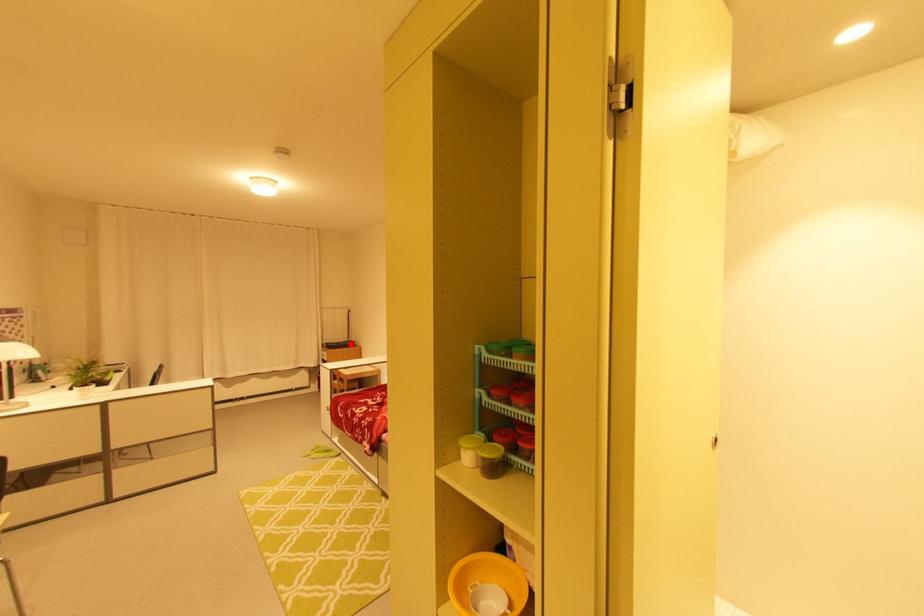
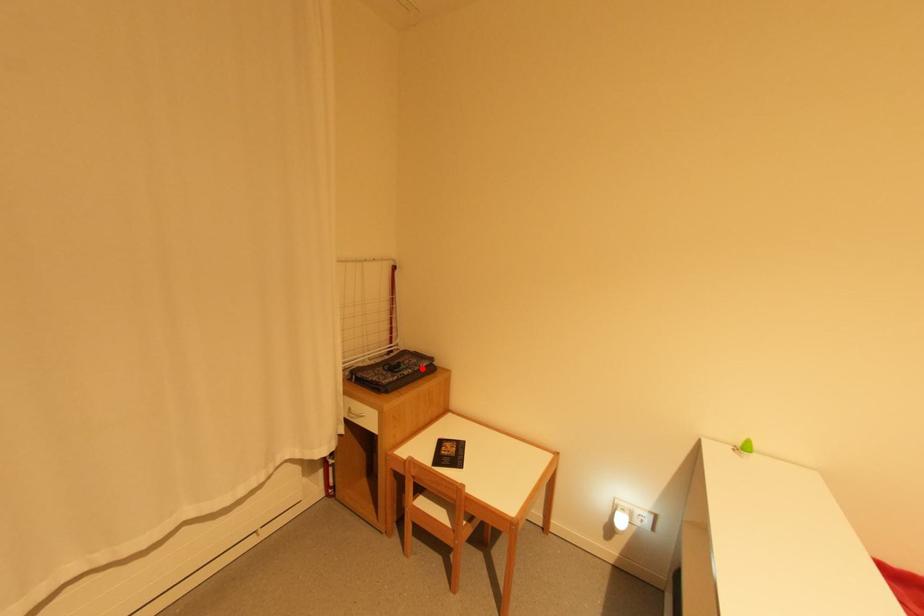
I am providing you with two images of the same scene from different viewpoints. A red point is marked on the first image and another point is marked on the second image. Is the marked point in image1 the same physical position as the marked point in image2?

Yes